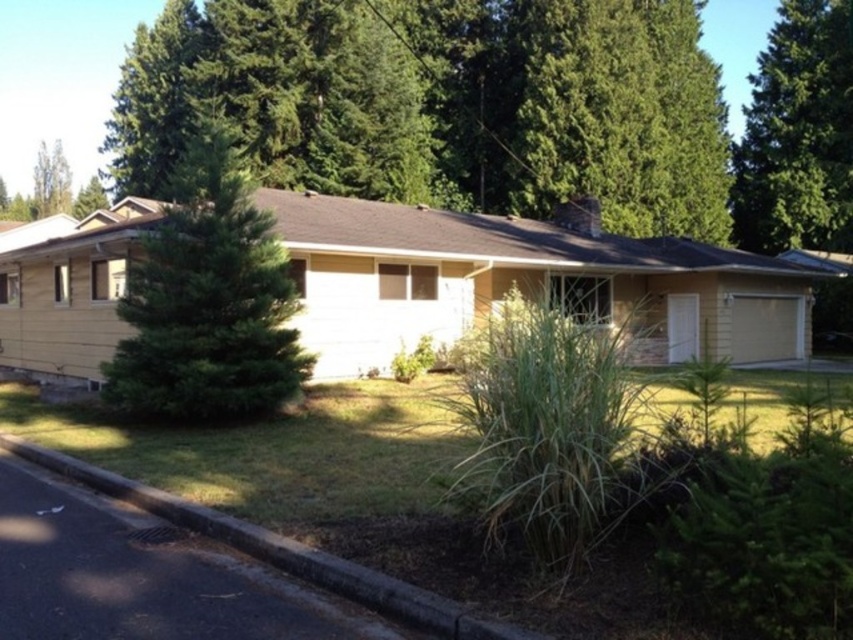
Who is positioned more to the left, green needle-like tree at left or green leafy tree at upper right?

Positioned to the left is green needle-like tree at left.

Between point (183, 396) and point (834, 236), which one is positioned behind?

Positioned behind is point (834, 236).

Locate an element on the screen. This screenshot has width=853, height=640. green needle-like tree at left is located at coordinates (207, 300).

Who is lower down, green leafy tree at upper right or black asphalt curb at lower left?

black asphalt curb at lower left is lower down.

Is green leafy tree at upper right wider than black asphalt curb at lower left?

Indeed, green leafy tree at upper right has a greater width compared to black asphalt curb at lower left.

Where is `green leafy tree at upper right`? Image resolution: width=853 pixels, height=640 pixels. green leafy tree at upper right is located at coordinates (798, 134).

Which of these two, green needle-like tree at left or black asphalt curb at lower left, stands shorter?

With less height is black asphalt curb at lower left.

Is point (216, 157) more distant than point (143, 506)?

Yes.

Between point (196, 410) and point (64, 456), which one is positioned in front?

Point (64, 456) is more forward.

Identify the location of green needle-like tree at left. (207, 300).